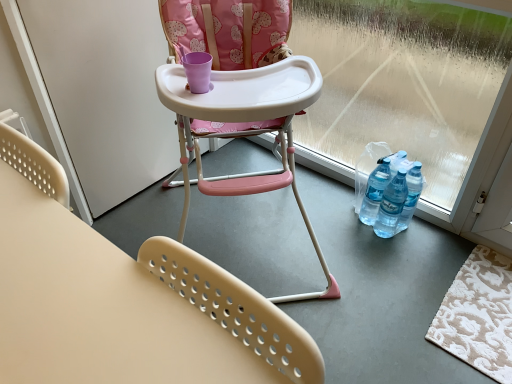
Image resolution: width=512 pixels, height=384 pixels. Find the location of `empty space that is in between transparent plastic window screen at lower right and beige textured rug at lower right`. empty space that is in between transparent plastic window screen at lower right and beige textured rug at lower right is located at coordinates tap(385, 244).